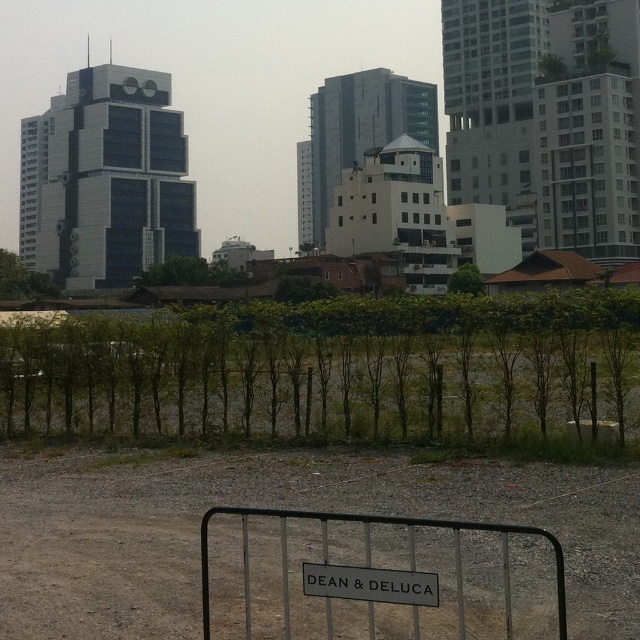
Question: Which of the following is the farthest from the observer?

Choices:
 (A) (561, 612)
 (B) (317, 593)
 (C) (35, 486)

Answer: (C)

Question: Which point is farther to the camera?

Choices:
 (A) black metal sign at lower center
 (B) metallic silver fence at lower center
 (C) dirt field at lower center

Answer: (C)

Question: Can you confirm if dirt field at lower center is thinner than black metal sign at lower center?

Choices:
 (A) no
 (B) yes

Answer: (A)

Question: Which point appears farthest from the camera in this image?

Choices:
 (A) (134, 513)
 (B) (339, 576)

Answer: (A)

Question: Observing the image, what is the correct spatial positioning of dirt field at lower center in reference to black metal sign at lower center?

Choices:
 (A) below
 (B) above

Answer: (A)

Question: Does dirt field at lower center have a larger size compared to black metal sign at lower center?

Choices:
 (A) no
 (B) yes

Answer: (B)